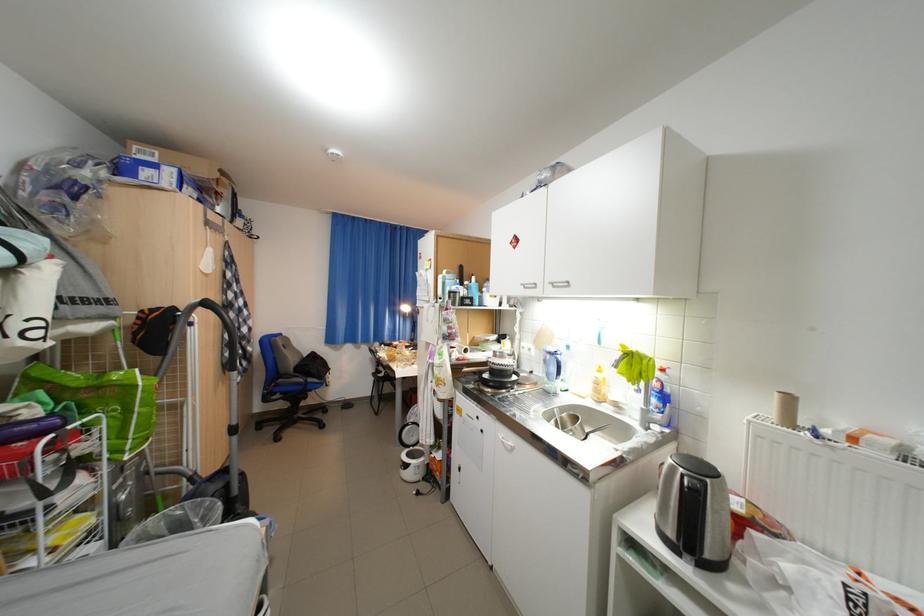
Find the location of a particular element. The height and width of the screenshot is (616, 924). kettle handle is located at coordinates (690, 521).